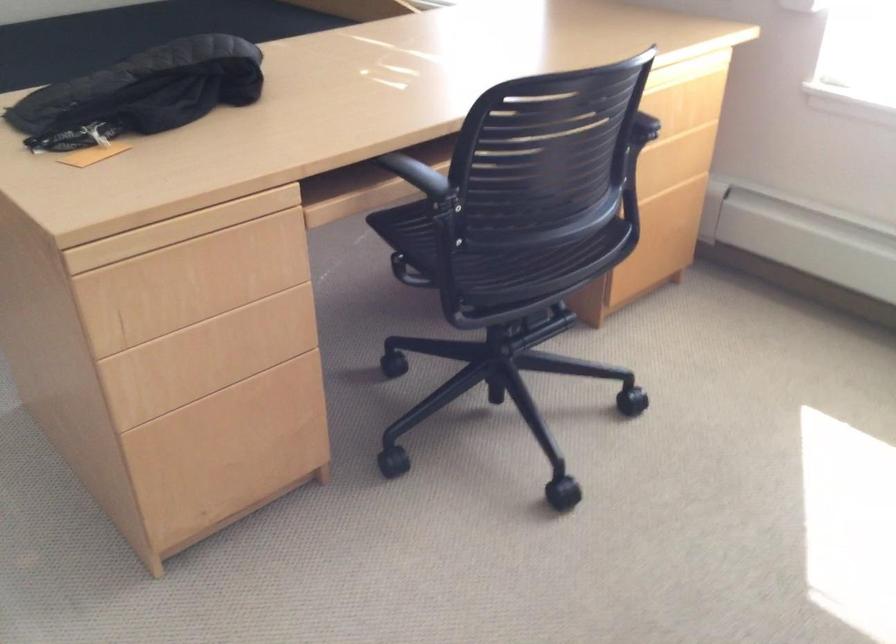
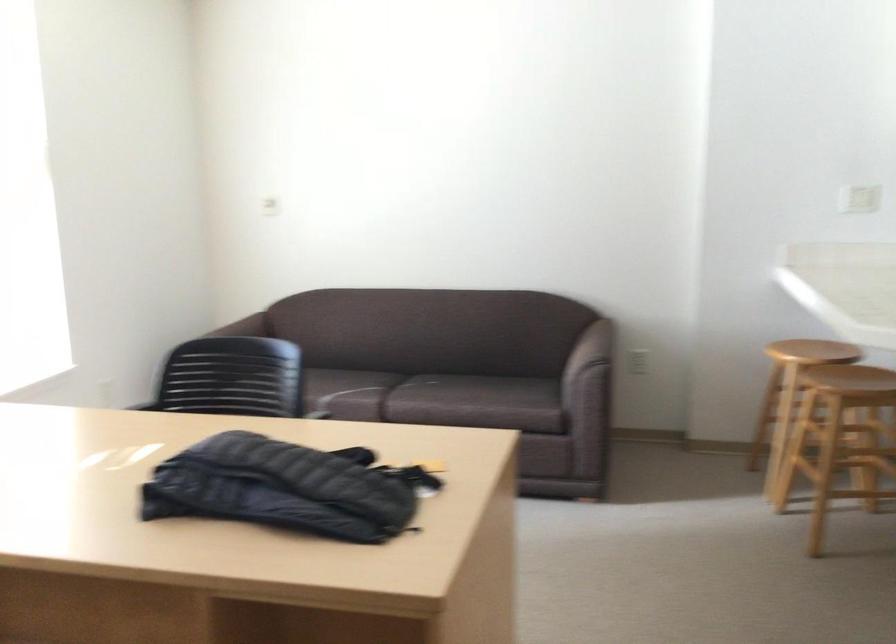
Question: I am providing you with two images of the same scene from different viewpoints. After the viewpoint changes to image2, which objects are now occluded?

Choices:
 (A) wooden drawer front
 (B) white light switch
 (C) brown sofa armrest
 (D) Volkl ski

Answer: (A)